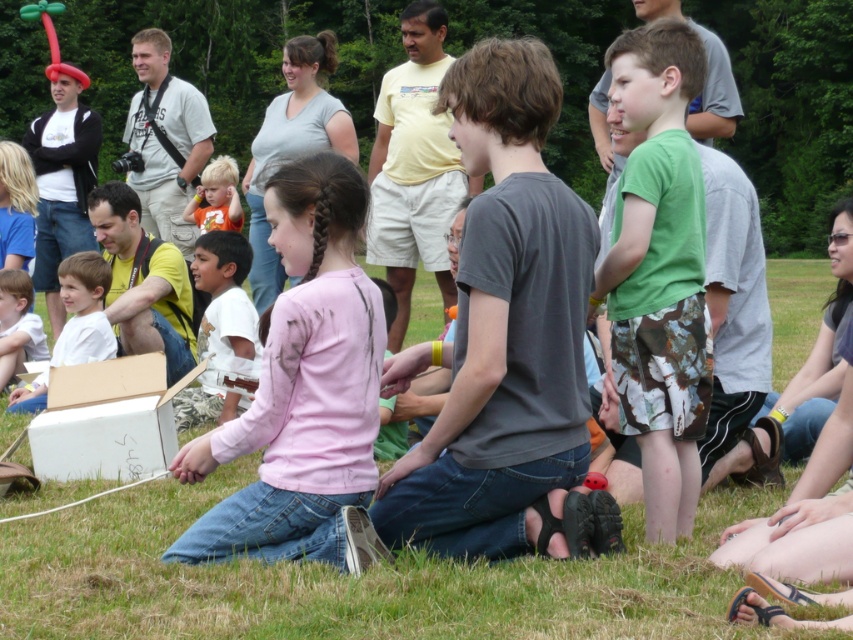
You are standing at the center of the image and want to place a small flag exactly at point (106,420). Which object should you use as a reference to locate this point?

The point (106,420) is on the white cardboard box at lower left, so you should use the white cardboard box at lower left as a reference to locate this point.

You are setting up a picnic area and need to choose between placing a blanket under the white cardboard box at lower left or the light brown wooden chair at lower left. Which object requires a larger blanket to cover it completely?

The white cardboard box at lower left requires a larger blanket because it has a larger size compared to the light brown wooden chair at lower left.

You are standing at the center of the image and want to place a new object at the same 2D location as the white cardboard box at lower left. What are the coordinates you should use?

The coordinates for the white cardboard box at lower left are (106, 420).